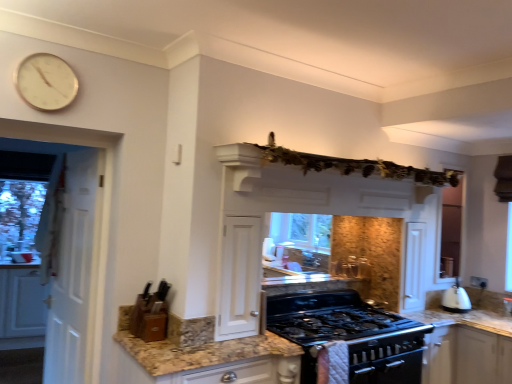
Question: Is white matte exhaust hood at upper center in front of black matte gas stove at center, positioned as the 2th appliance in left-to-right order?

Choices:
 (A) no
 (B) yes

Answer: (B)

Question: Can you confirm if white matte exhaust hood at upper center is positioned to the right of black matte gas stove at center, arranged as the 1th appliance when viewed from the right?

Choices:
 (A) yes
 (B) no

Answer: (A)

Question: Considering the relative sizes of white matte exhaust hood at upper center and black matte gas stove at center, acting as the 2th appliance starting from the top, in the image provided, is white matte exhaust hood at upper center shorter than black matte gas stove at center, acting as the 2th appliance starting from the top,?

Choices:
 (A) no
 (B) yes

Answer: (B)

Question: From a real-world perspective, is white matte exhaust hood at upper center on black matte gas stove at center, arranged as the 1th appliance when viewed from the right?

Choices:
 (A) yes
 (B) no

Answer: (A)

Question: From the image's perspective, would you say white matte exhaust hood at upper center is positioned over black matte gas stove at center, positioned as the 2th appliance in left-to-right order?

Choices:
 (A) no
 (B) yes

Answer: (B)

Question: From the image's perspective, is white matte exhaust hood at upper center above or below white wooden door at left?

Choices:
 (A) below
 (B) above

Answer: (B)

Question: From a real-world perspective, is white matte exhaust hood at upper center above or below white wooden door at left?

Choices:
 (A) below
 (B) above

Answer: (B)

Question: In terms of height, does white matte exhaust hood at upper center look taller or shorter compared to white wooden door at left?

Choices:
 (A) tall
 (B) short

Answer: (B)

Question: Is white matte exhaust hood at upper center in front of or behind white wooden door at left in the image?

Choices:
 (A) front
 (B) behind

Answer: (A)

Question: Is black matte gas stove at center, arranged as the 1th appliance when viewed from the right, taller or shorter than white matte exhaust hood at upper center?

Choices:
 (A) short
 (B) tall

Answer: (B)

Question: Choose the correct answer: Is black matte gas stove at center, positioned as the 2th appliance in left-to-right order, inside white matte exhaust hood at upper center or outside it?

Choices:
 (A) outside
 (B) inside

Answer: (A)

Question: From a real-world perspective, is black matte gas stove at center, positioned as the 2th appliance in left-to-right order, physically located above or below white matte exhaust hood at upper center?

Choices:
 (A) above
 (B) below

Answer: (B)

Question: In terms of size, does black matte gas stove at center, acting as the 2th appliance starting from the top, appear bigger or smaller than white matte exhaust hood at upper center?

Choices:
 (A) big
 (B) small

Answer: (A)

Question: Based on their sizes in the image, would you say white matte exhaust hood at upper center is bigger or smaller than white matte cabinet at left?

Choices:
 (A) small
 (B) big

Answer: (A)

Question: From their relative heights in the image, would you say white matte exhaust hood at upper center is taller or shorter than white matte cabinet at left?

Choices:
 (A) short
 (B) tall

Answer: (A)